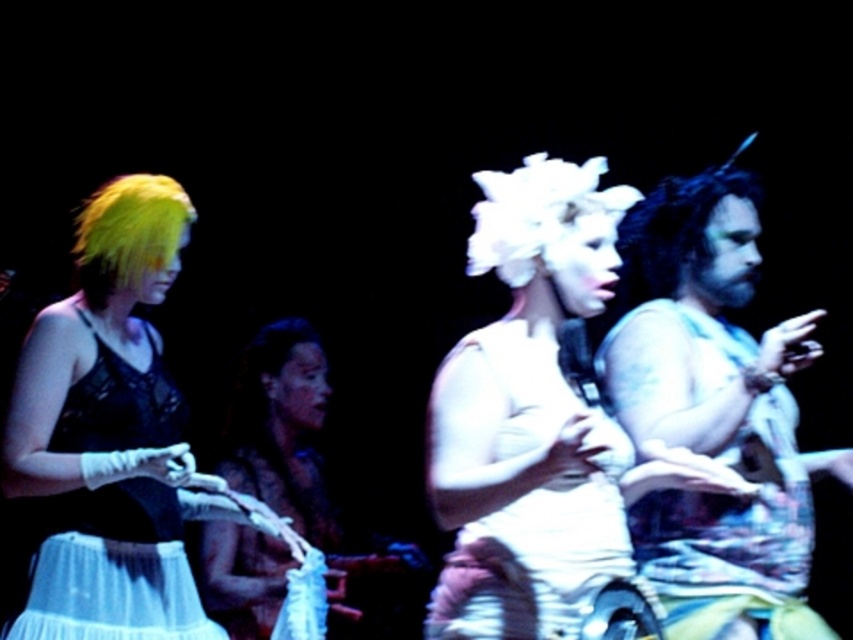
Question: Which of the following is the farthest from the observer?

Choices:
 (A) (125, 413)
 (B) (233, 573)
 (C) (722, 170)
 (D) (96, 291)

Answer: (B)

Question: Which object is closer to the camera taking this photo?

Choices:
 (A) white fluffy wig at center
 (B) shiny yellow wig at left
 (C) black lace dress at left
 (D) matte black dress at center

Answer: (A)

Question: Does white fluffy wig at center appear over shiny yellow wig at left?

Choices:
 (A) no
 (B) yes

Answer: (A)

Question: Estimate the real-world distances between objects in this image. Which object is closer to the bearded man with tattoos at right?

Choices:
 (A) white fluffy wig at center
 (B) matte black dress at center

Answer: (A)

Question: Does white fluffy wig at center have a larger size compared to shiny yellow wig at left?

Choices:
 (A) yes
 (B) no

Answer: (A)

Question: Is white fluffy wig at center behind bearded man with tattoos at right?

Choices:
 (A) no
 (B) yes

Answer: (A)